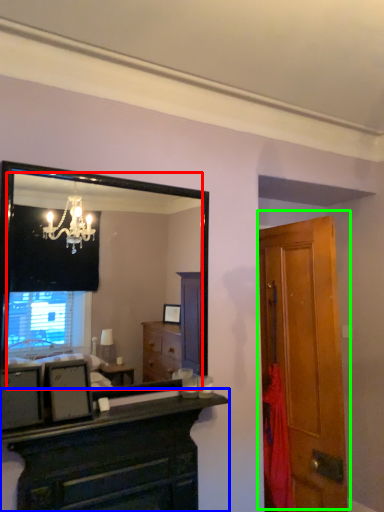
Question: Which object is positioned farthest from mirror (highlighted by a red box)? Select from chest of drawers (highlighted by a blue box) and door (highlighted by a green box).

Choices:
 (A) chest of drawers
 (B) door

Answer: (A)